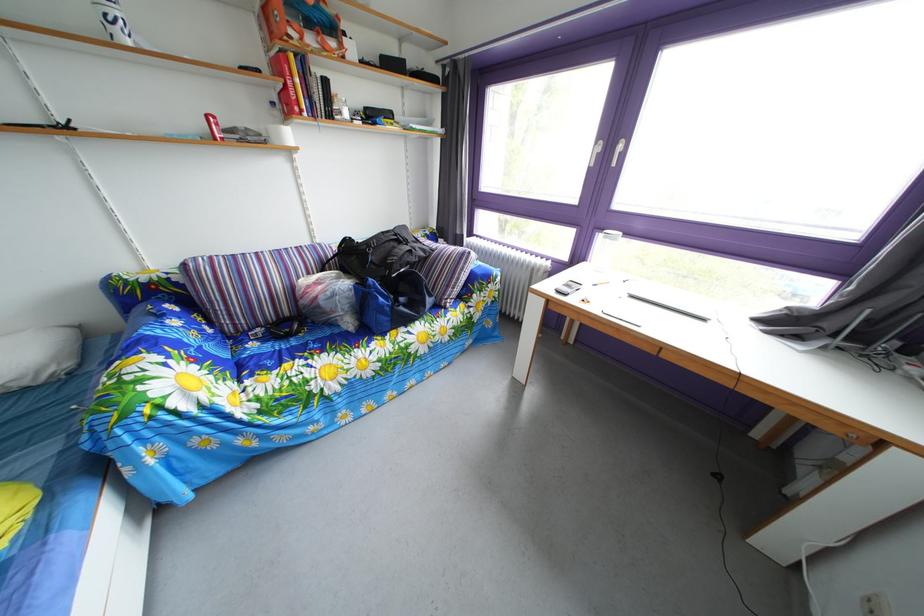
Which object does [381,253] point to?

It corresponds to the black backpack in the image.